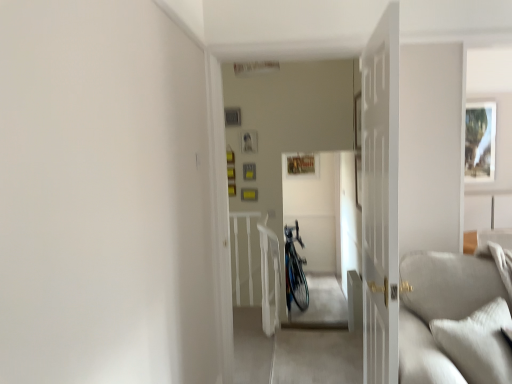
Question: Is the position of light gray corduroy couch at lower right less distant than that of shiny metallic bicycle at center?

Choices:
 (A) yes
 (B) no

Answer: (A)

Question: From a real-world perspective, is light gray corduroy couch at lower right on top of shiny metallic bicycle at center?

Choices:
 (A) no
 (B) yes

Answer: (B)

Question: Is light gray corduroy couch at lower right placed right next to shiny metallic bicycle at center?

Choices:
 (A) no
 (B) yes

Answer: (A)

Question: Considering the relative sizes of light gray corduroy couch at lower right and shiny metallic bicycle at center in the image provided, is light gray corduroy couch at lower right taller than shiny metallic bicycle at center?

Choices:
 (A) no
 (B) yes

Answer: (A)

Question: From the image's perspective, is light gray corduroy couch at lower right located above shiny metallic bicycle at center?

Choices:
 (A) yes
 (B) no

Answer: (A)

Question: Considering the relative positions of light gray corduroy couch at lower right and shiny metallic bicycle at center in the image provided, is light gray corduroy couch at lower right to the left of shiny metallic bicycle at center from the viewer's perspective?

Choices:
 (A) no
 (B) yes

Answer: (A)

Question: Considering the relative positions of light gray corduroy couch at lower right and white wooden door at center in the image provided, is light gray corduroy couch at lower right in front of white wooden door at center?

Choices:
 (A) no
 (B) yes

Answer: (A)

Question: Can white wooden door at center be found inside light gray corduroy couch at lower right?

Choices:
 (A) no
 (B) yes

Answer: (A)

Question: Is light gray corduroy couch at lower right wider than white wooden door at center?

Choices:
 (A) no
 (B) yes

Answer: (B)

Question: Can you confirm if light gray corduroy couch at lower right is taller than white wooden door at center?

Choices:
 (A) yes
 (B) no

Answer: (B)

Question: Is light gray corduroy couch at lower right oriented towards white wooden door at center?

Choices:
 (A) yes
 (B) no

Answer: (B)

Question: From the image's perspective, is light gray corduroy couch at lower right located beneath white wooden door at center?

Choices:
 (A) yes
 (B) no

Answer: (A)

Question: Considering the relative sizes of shiny metallic bicycle at center and matte white picture frame at upper right in the image provided, is shiny metallic bicycle at center bigger than matte white picture frame at upper right?

Choices:
 (A) no
 (B) yes

Answer: (B)